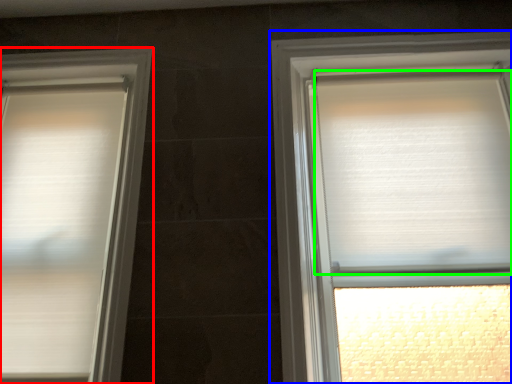
Question: Considering the real-world distances, which object is closest to window (highlighted by a red box)? window (highlighted by a blue box) or blind (highlighted by a green box).

Choices:
 (A) window
 (B) blind

Answer: (A)